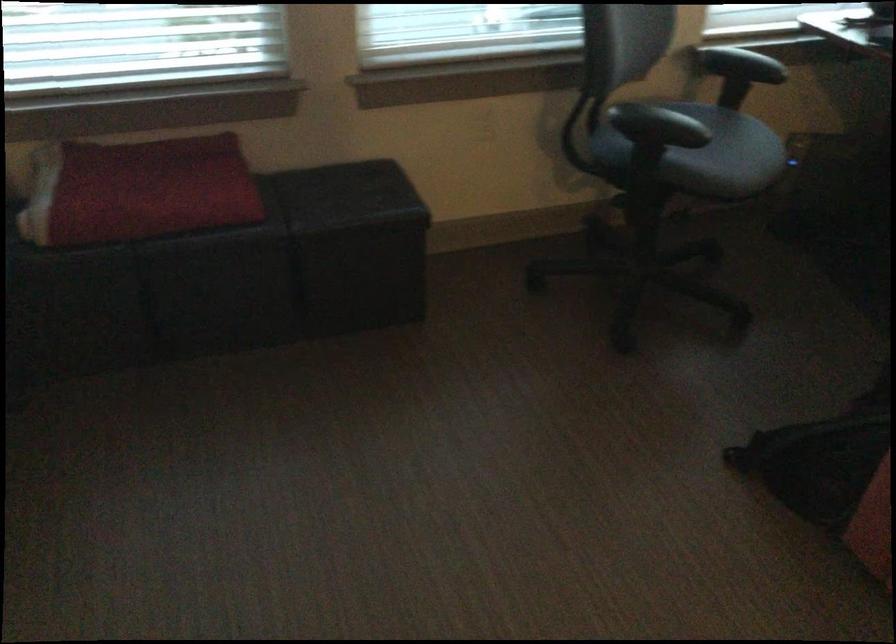
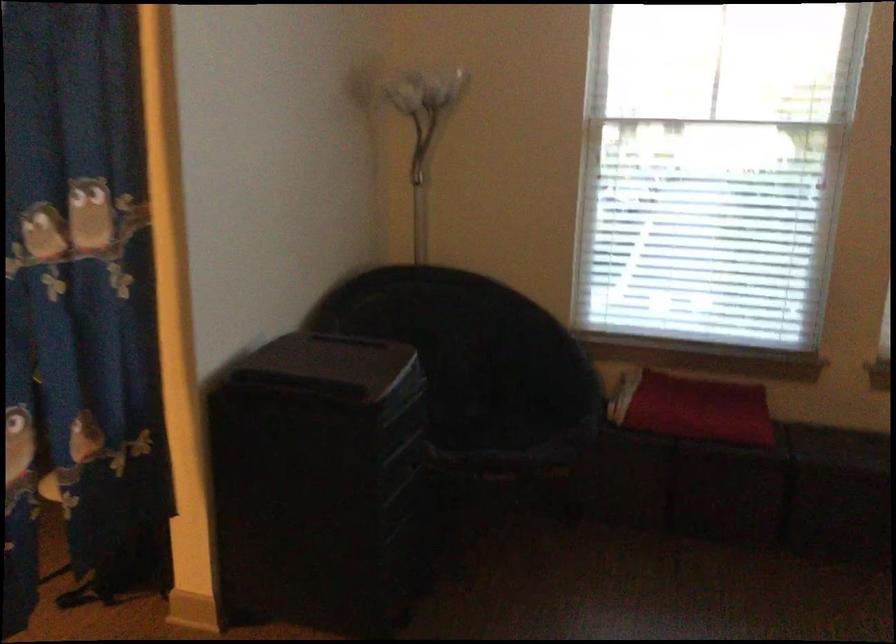
Question: The camera is either moving clockwise (left) or counter-clockwise (right) around the object. The first image is from the beginning of the video and the second image is from the end. Is the camera moving left or right when shooting the video?

Choices:
 (A) Left
 (B) Right

Answer: (B)